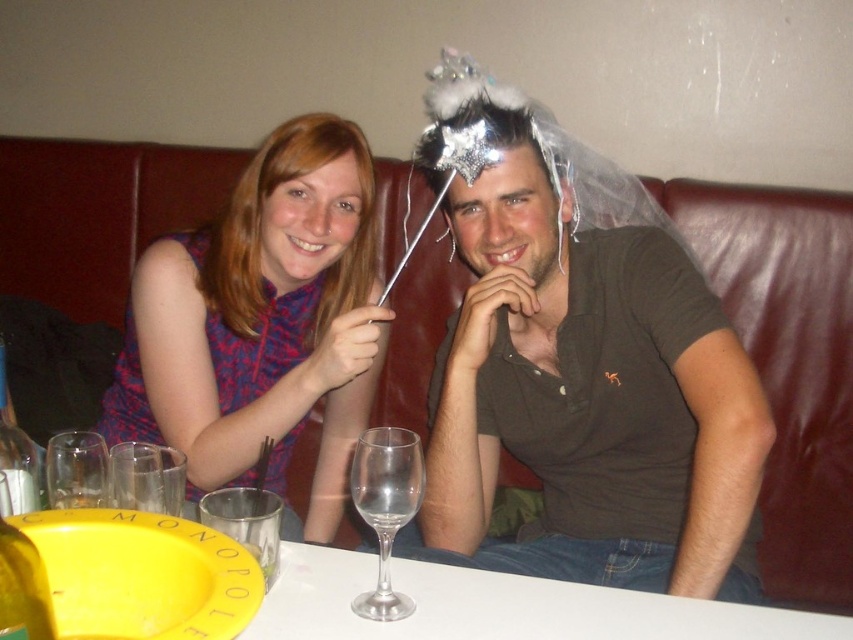
You are a photographer standing at the camera position. You need to place a decorative item exactly 4 feet away from the camera to frame the scene. The shiny silver headdress at upper center is already present. Can you use it as the decorative item?

The shiny silver headdress at upper center is 3.76 feet from the camera, which is slightly less than 4 feet. Therefore, it cannot be used as the decorative item since it is closer than the required distance.

You are standing 1 meter away from the camera. You want to reach the point at coordinates point [695,321]. Can you reach it without moving closer?

The point [695,321] is 1.14 meters from the camera. Since you are only 1 meter away from the camera, you are closer than the point, so you cannot reach it without moving closer.

You are a server in a restaurant and need to place a new plate on the table. The plate is 10 cm in diameter. Can you fit it on the white glossy table at center without it overlapping the transparent glass wine glass at center?

The white glossy table at center has a lesser height compared to transparent glass wine glass at center, which means the table is shorter than the wine glass. However, the height difference does not directly indicate the available space on the table. To determine if the plate can fit without overlapping, we need to know the horizontal distance between the table and the wine glass. Since this information is not provided, it is impossible to confirm if the plate will fit.